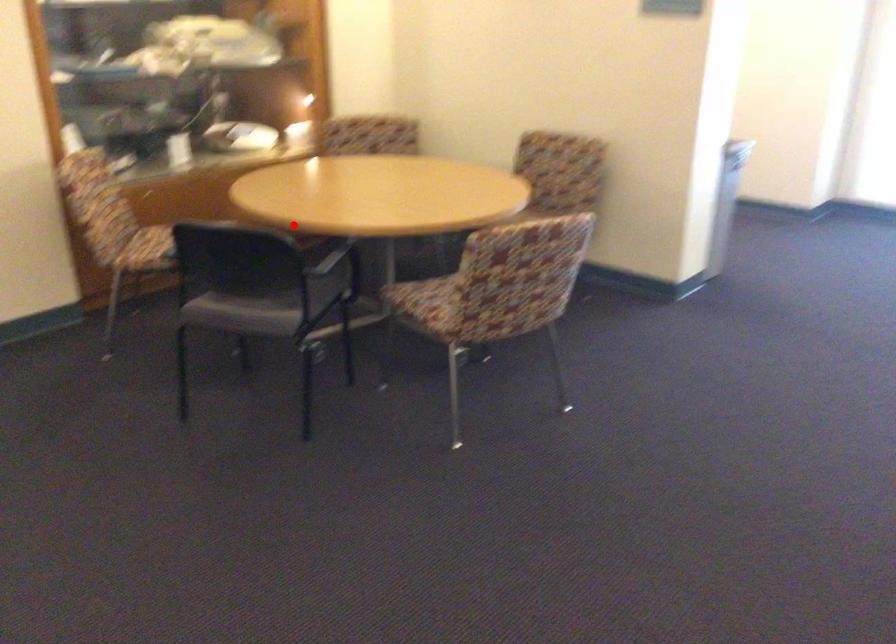
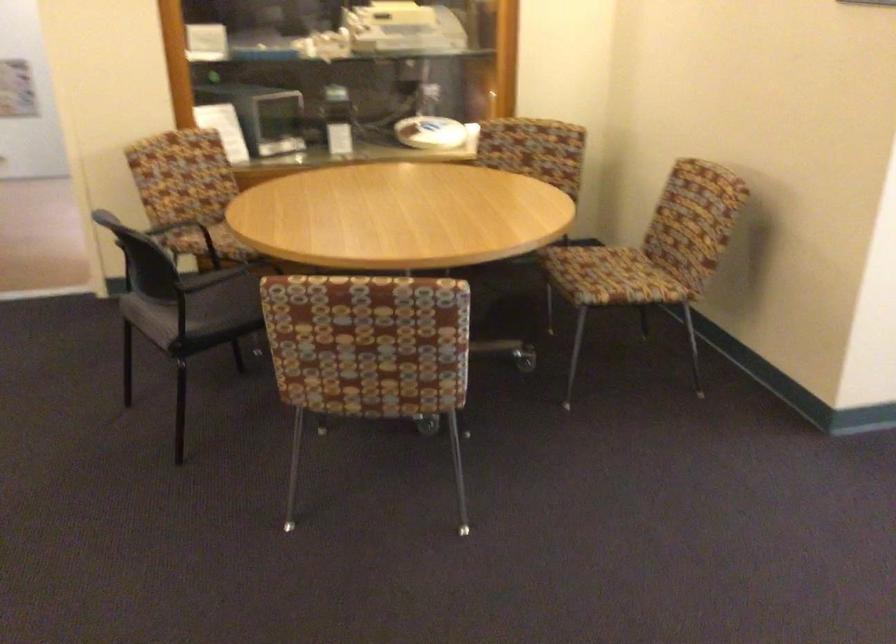
Question: A red point is marked in image1. In image2, is the corresponding 3D point closer to the camera or farther? Reply with the corresponding letter.

Choices:
 (A) The corresponding 3D point is closer.
 (B) The corresponding 3D point is farther.

Answer: (A)